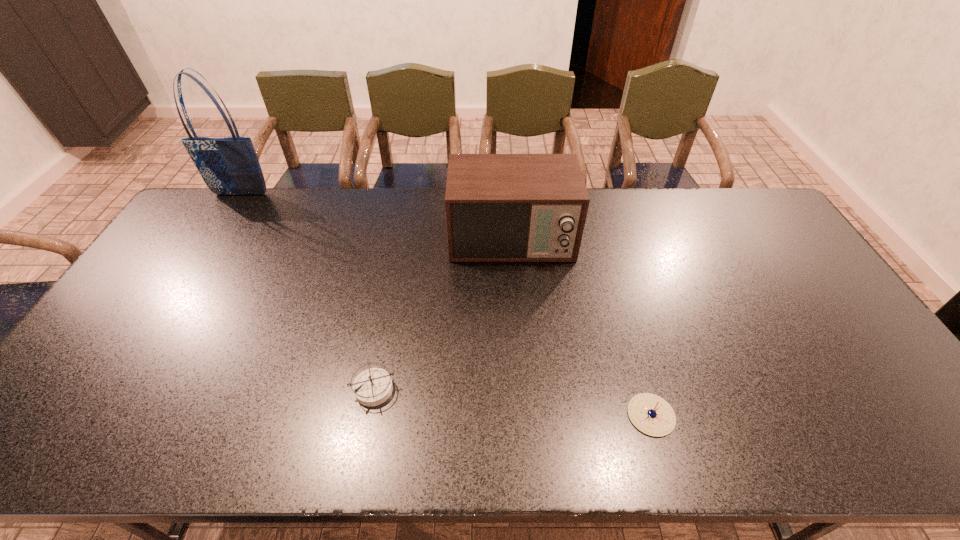
Locate an element on the screen. The image size is (960, 540). empty location between the third nearest object and the rightmost object is located at coordinates (581, 327).

Identify the location of free space between the rightmost object and the shopping bag. (446, 305).

Where is `vacant point located between the leftmost object and the third nearest object`? vacant point located between the leftmost object and the third nearest object is located at coordinates (376, 217).

The width and height of the screenshot is (960, 540). What are the coordinates of `vacant space in between the shopping bag and the right compass` in the screenshot? It's located at (446, 305).

Identify the location of vacant space that is in between the third object from left to right and the rightmost object. This screenshot has height=540, width=960. (581, 327).

The height and width of the screenshot is (540, 960). I want to click on vacant area that lies between the shopping bag and the third object from right to left, so click(307, 291).

Locate an element on the screen. The height and width of the screenshot is (540, 960). vacant space that's between the right compass and the farthest object is located at coordinates (446, 305).

Image resolution: width=960 pixels, height=540 pixels. Find the location of `unoccupied area between the rightmost object and the tallest object`. unoccupied area between the rightmost object and the tallest object is located at coordinates (446, 305).

Image resolution: width=960 pixels, height=540 pixels. Identify the location of free space between the third nearest object and the farthest object. (376, 217).

Where is `the second closest object relative to the right compass`? The image size is (960, 540). the second closest object relative to the right compass is located at coordinates (372, 387).